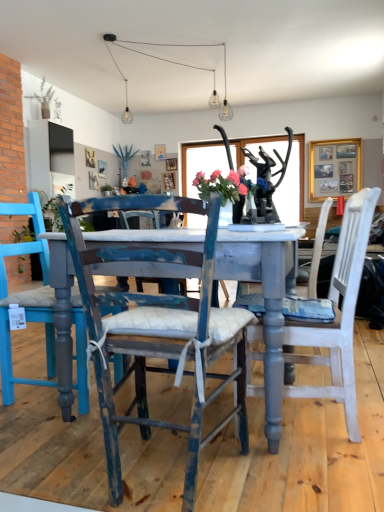
Question: Does distressed blue wood chair at center, the second chair when ordered from right to left, have a lesser height compared to white painted wood chair at center, which is counted as the second chair, starting from the left?

Choices:
 (A) no
 (B) yes

Answer: (B)

Question: Does distressed blue wood chair at center, the second chair when ordered from right to left, have a smaller size compared to white painted wood chair at center, which appears as the 1th chair when viewed from the right?

Choices:
 (A) yes
 (B) no

Answer: (A)

Question: Considering the relative positions of distressed blue wood chair at center, the first chair in the left-to-right sequence, and white painted wood chair at center, which is counted as the second chair, starting from the left, in the image provided, is distressed blue wood chair at center, the first chair in the left-to-right sequence, behind white painted wood chair at center, which is counted as the second chair, starting from the left,?

Choices:
 (A) yes
 (B) no

Answer: (B)

Question: Considering the relative sizes of distressed blue wood chair at center, the first chair in the left-to-right sequence, and white painted wood chair at center, which is counted as the second chair, starting from the left, in the image provided, is distressed blue wood chair at center, the first chair in the left-to-right sequence, wider than white painted wood chair at center, which is counted as the second chair, starting from the left,?

Choices:
 (A) no
 (B) yes

Answer: (A)

Question: Can you confirm if distressed blue wood chair at center, the second chair when ordered from right to left, is thinner than white painted wood chair at center, which appears as the 1th chair when viewed from the right?

Choices:
 (A) yes
 (B) no

Answer: (A)

Question: In the image, is white painted wood chair at center, which is counted as the second chair, starting from the left, on the left side or the right side of distressed blue wood chair at center, the second chair when ordered from right to left?

Choices:
 (A) right
 (B) left

Answer: (A)

Question: Based on their sizes in the image, would you say white painted wood chair at center, which appears as the 1th chair when viewed from the right, is bigger or smaller than distressed blue wood chair at center, the first chair in the left-to-right sequence?

Choices:
 (A) small
 (B) big

Answer: (B)

Question: Is white painted wood chair at center, which is counted as the second chair, starting from the left, taller or shorter than distressed blue wood chair at center, the second chair when ordered from right to left?

Choices:
 (A) short
 (B) tall

Answer: (B)

Question: From a real-world perspective, is white painted wood chair at center, which is counted as the second chair, starting from the left, positioned above or below distressed blue wood chair at center, the second chair when ordered from right to left?

Choices:
 (A) above
 (B) below

Answer: (A)

Question: Is point (127, 153) closer or farther from the camera than point (185, 506)?

Choices:
 (A) closer
 (B) farther

Answer: (B)

Question: Would you say green leafy plant at upper center, positioned as the second plant in front-to-back order, is to the left or to the right of distressed blue wood chair at center, the second chair when ordered from right to left, in the picture?

Choices:
 (A) right
 (B) left

Answer: (B)

Question: Considering the positions of green leafy plant at upper center, positioned as the second plant in front-to-back order, and distressed blue wood chair at center, the first chair in the left-to-right sequence, in the image, is green leafy plant at upper center, positioned as the second plant in front-to-back order, taller or shorter than distressed blue wood chair at center, the first chair in the left-to-right sequence,?

Choices:
 (A) short
 (B) tall

Answer: (B)

Question: From a real-world perspective, is green leafy plant at upper center, which ranks as the second plant in left-to-right order, physically located above or below distressed blue wood chair at center, the first chair in the left-to-right sequence?

Choices:
 (A) below
 (B) above

Answer: (B)

Question: From their relative heights in the image, would you say white painted wood chair at center, which appears as the 1th chair when viewed from the right, is taller or shorter than white matte vase at upper left, acting as the 1th plant starting from the front?

Choices:
 (A) tall
 (B) short

Answer: (A)

Question: From the image's perspective, is white painted wood chair at center, which appears as the 1th chair when viewed from the right, located above or below white matte vase at upper left, which appears as the 1th plant when viewed from the left?

Choices:
 (A) below
 (B) above

Answer: (A)